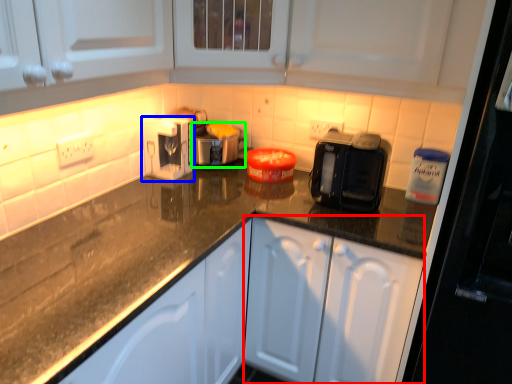
Question: Based on their relative distances, which object is nearer to cabinetry (highlighted by a red box)? Choose from kitchen appliance (highlighted by a blue box) and appliance (highlighted by a green box).

Choices:
 (A) kitchen appliance
 (B) appliance

Answer: (B)